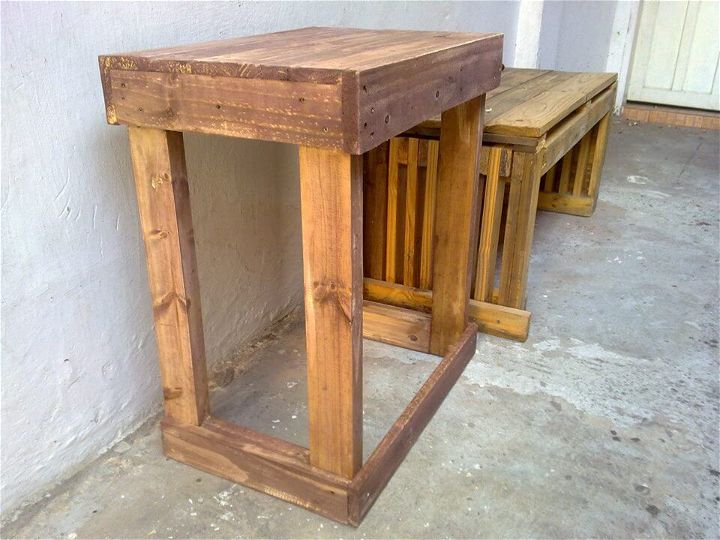
Find the location of a particular element. white door is located at coordinates (672, 101).